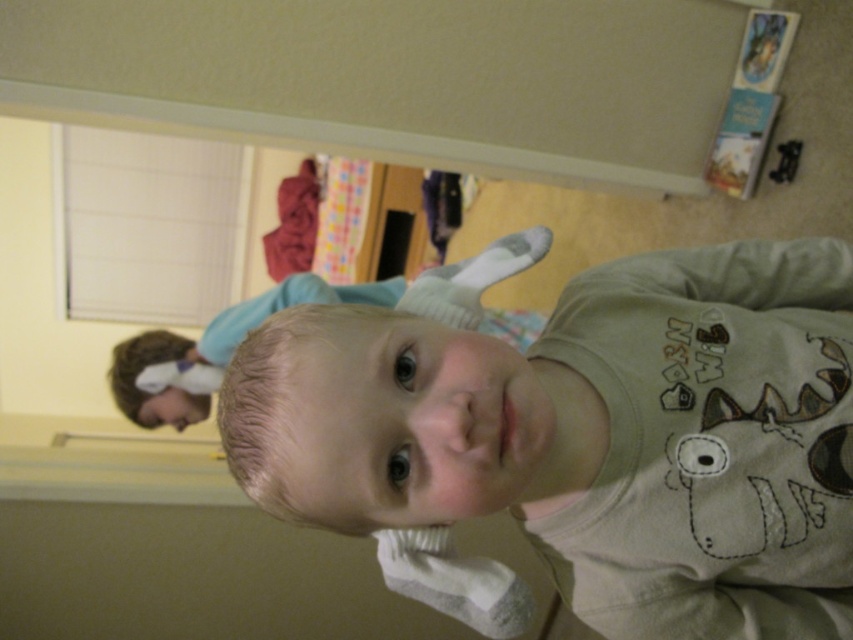
Question: Considering the relative positions of light brown cotton shirt at center and smooth beige baby at center in the image provided, where is light brown cotton shirt at center located with respect to smooth beige baby at center?

Choices:
 (A) right
 (B) left

Answer: (A)

Question: Which point is farther to the camera?

Choices:
 (A) [193, 358]
 (B) [221, 422]

Answer: (A)

Question: Is light brown cotton shirt at center wider than smooth beige baby at center?

Choices:
 (A) no
 (B) yes

Answer: (A)

Question: Which point is closer to the camera?

Choices:
 (A) smooth beige baby at center
 (B) light brown cotton shirt at center

Answer: (B)

Question: Which of the following is the farthest from the observer?

Choices:
 (A) smooth beige baby at center
 (B) light brown cotton shirt at center

Answer: (A)

Question: Can you confirm if light brown cotton shirt at center is wider than smooth beige baby at center?

Choices:
 (A) no
 (B) yes

Answer: (A)